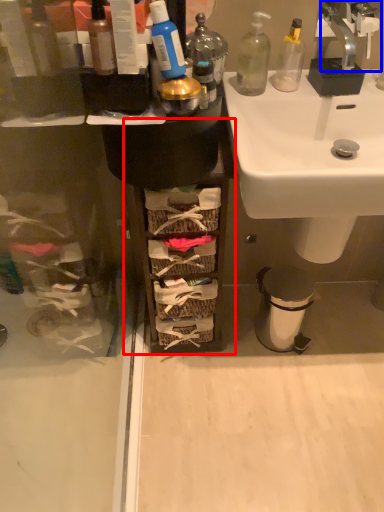
Question: Which object is closer to the camera taking this photo, cabinetry (highlighted by a red box) or tap (highlighted by a blue box)?

Choices:
 (A) cabinetry
 (B) tap

Answer: (B)